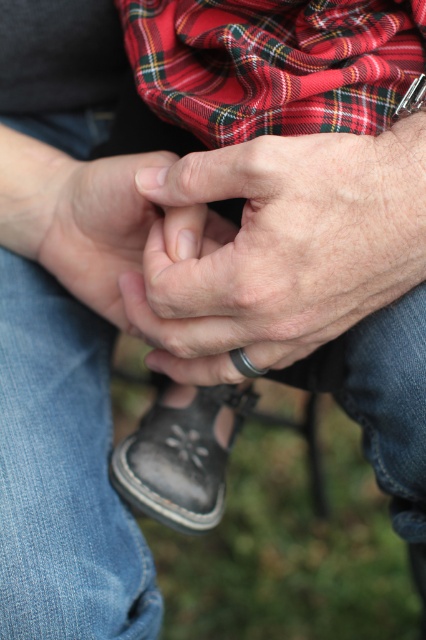
Is red plaid scarf at upper center wider than smooth skin hand at center?

Indeed, red plaid scarf at upper center has a greater width compared to smooth skin hand at center.

Does red plaid scarf at upper center have a lesser height compared to smooth skin hand at center?

Correct, red plaid scarf at upper center is not as tall as smooth skin hand at center.

Does point (328, 28) come closer to viewer compared to point (114, 179)?

Yes, it is in front of point (114, 179).

In order to click on red plaid scarf at upper center in this screenshot , I will do click(273, 64).

The image size is (426, 640). What do you see at coordinates (279, 248) in the screenshot?
I see `leather ring at center` at bounding box center [279, 248].

Between leather ring at center and smooth skin hand at center, which one appears on the right side from the viewer's perspective?

leather ring at center

This screenshot has width=426, height=640. I want to click on leather ring at center, so click(x=279, y=248).

Based on the photo, does red plaid scarf at upper center have a smaller size compared to leather sandal at lower center?

Incorrect, red plaid scarf at upper center is not smaller in size than leather sandal at lower center.

Is red plaid scarf at upper center bigger than leather sandal at lower center?

Yes, red plaid scarf at upper center is bigger than leather sandal at lower center.

I want to click on red plaid scarf at upper center, so click(x=273, y=64).

In order to click on red plaid scarf at upper center in this screenshot , I will do `click(273, 64)`.